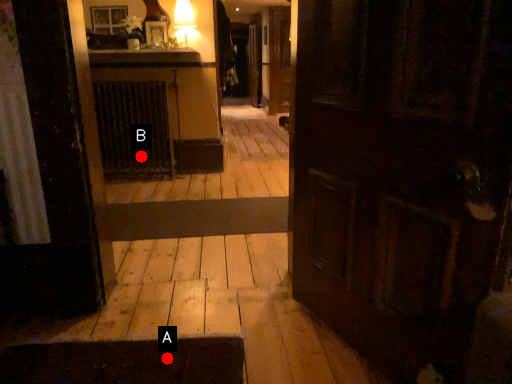
Question: Two points are circled on the image, labeled by A and B beside each circle. Which point is closer to the camera?

Choices:
 (A) A is closer
 (B) B is closer

Answer: (A)